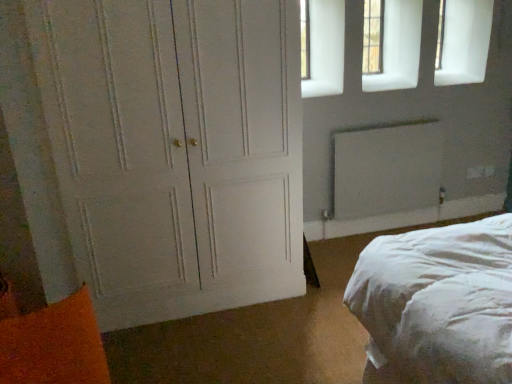
Question: Does white matte radiator at upper right have a greater width compared to white painted wood door at left?

Choices:
 (A) no
 (B) yes

Answer: (A)

Question: Can you confirm if white matte radiator at upper right is smaller than white painted wood door at left?

Choices:
 (A) yes
 (B) no

Answer: (A)

Question: Does white matte radiator at upper right have a larger size compared to white painted wood door at left?

Choices:
 (A) no
 (B) yes

Answer: (A)

Question: Considering the relative sizes of white matte radiator at upper right and white painted wood door at left in the image provided, is white matte radiator at upper right taller than white painted wood door at left?

Choices:
 (A) no
 (B) yes

Answer: (A)

Question: Is white matte radiator at upper right outside white painted wood door at left?

Choices:
 (A) no
 (B) yes

Answer: (B)

Question: From the image's perspective, is orange fuzzy pillow at lower left above or below clear glass window at upper right?

Choices:
 (A) below
 (B) above

Answer: (A)

Question: Is orange fuzzy pillow at lower left bigger or smaller than clear glass window at upper right?

Choices:
 (A) small
 (B) big

Answer: (B)

Question: Would you say orange fuzzy pillow at lower left is inside or outside clear glass window at upper right?

Choices:
 (A) outside
 (B) inside

Answer: (A)

Question: From their relative heights in the image, would you say orange fuzzy pillow at lower left is taller or shorter than clear glass window at upper right?

Choices:
 (A) short
 (B) tall

Answer: (B)

Question: Does point (353, 160) appear closer or farther from the camera than point (375, 51)?

Choices:
 (A) farther
 (B) closer

Answer: (B)

Question: From the image's perspective, relative to clear glass window at upper right, is white matte radiator at upper right above or below?

Choices:
 (A) below
 (B) above

Answer: (A)

Question: Based on their positions, is white matte radiator at upper right located to the left or right of clear glass window at upper right?

Choices:
 (A) left
 (B) right

Answer: (B)

Question: Is white matte radiator at upper right inside or outside of clear glass window at upper right?

Choices:
 (A) inside
 (B) outside

Answer: (B)

Question: In terms of height, does white matte radiator at upper right look taller or shorter compared to orange fuzzy pillow at lower left?

Choices:
 (A) tall
 (B) short

Answer: (A)

Question: Would you say white matte radiator at upper right is inside or outside orange fuzzy pillow at lower left?

Choices:
 (A) inside
 (B) outside

Answer: (B)